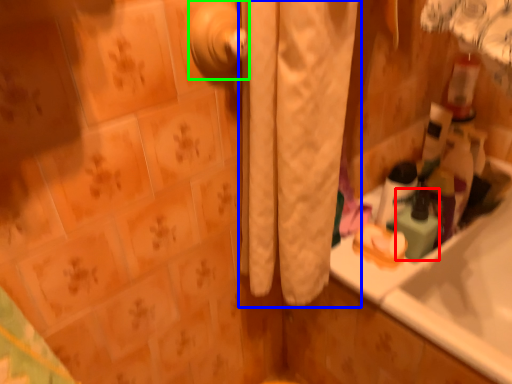
Question: Which is farther away from cleaning product (highlighted by a red box)? curtain (highlighted by a blue box) or door handle (highlighted by a green box)?

Choices:
 (A) curtain
 (B) door handle

Answer: (B)